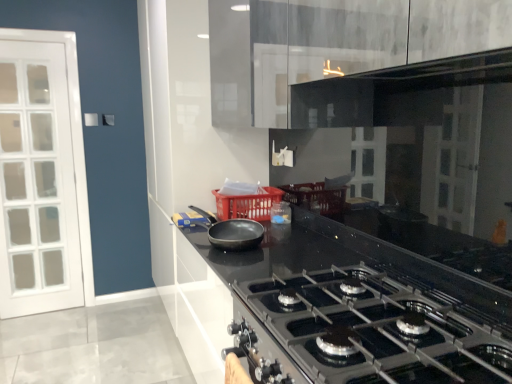
Question: From the image's perspective, relative to matte black pan at center, is black glossy countertop at center above or below?

Choices:
 (A) below
 (B) above

Answer: (A)

Question: Is black glossy countertop at center bigger or smaller than matte black pan at center?

Choices:
 (A) big
 (B) small

Answer: (A)

Question: Which object is positioned closest to the matte black pan at center?

Choices:
 (A) red plastic basket at center
 (B) translucent plastic container at center
 (C) black glossy countertop at center

Answer: (A)

Question: Estimate the real-world distances between objects in this image. Which object is closer to the translucent plastic container at center?

Choices:
 (A) black glossy countertop at center
 (B) matte black pan at center
 (C) red plastic basket at center

Answer: (C)